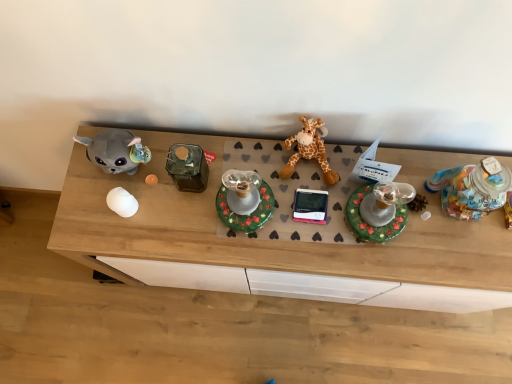
The image size is (512, 384). What are the coordinates of `vacant area to the left of green matte candle holder at center, which is the third toy from right to left` in the screenshot? It's located at (188, 219).